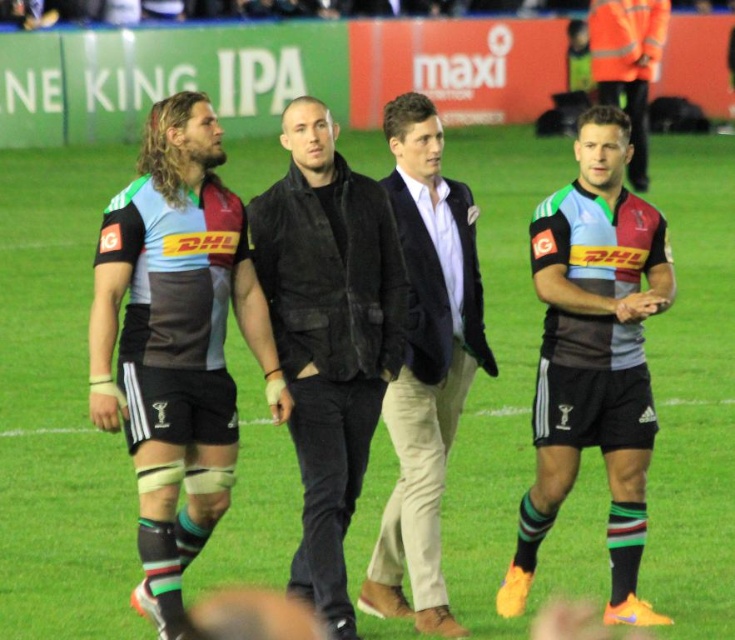
Question: Does striped jersey at center appear on the left side of matte black shorts at right?

Choices:
 (A) yes
 (B) no

Answer: (A)

Question: Is striped jersey at center wider than light brown leather jacket at center?

Choices:
 (A) no
 (B) yes

Answer: (B)

Question: In this image, where is black leather jacket at center located relative to light brown leather jacket at center?

Choices:
 (A) left
 (B) right

Answer: (A)

Question: Which object is closer to the camera taking this photo?

Choices:
 (A) black leather jacket at center
 (B) matte jersey at left
 (C) striped jersey at center

Answer: (B)

Question: Which object appears closest to the camera in this image?

Choices:
 (A) striped jersey at center
 (B) matte black shorts at right
 (C) light brown leather jacket at center
 (D) black leather jacket at center

Answer: (D)

Question: Which of these objects is positioned farthest from the black leather jacket at center?

Choices:
 (A) matte black shorts at right
 (B) light brown leather jacket at center
 (C) striped jersey at center
 (D) matte jersey at left

Answer: (A)